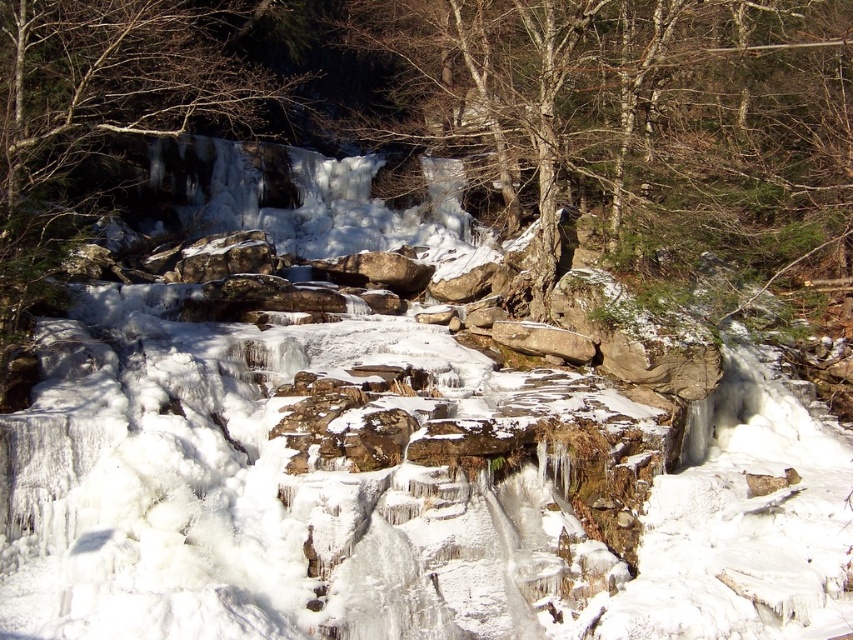
In the scene shown: Which is more to the left, bare wood tree at center or smooth bark tree at upper left?

smooth bark tree at upper left is more to the left.

Can you confirm if bare wood tree at center is wider than smooth bark tree at upper left?

Yes, bare wood tree at center is wider than smooth bark tree at upper left.

This screenshot has height=640, width=853. In order to click on bare wood tree at center in this screenshot , I will do `click(634, 115)`.